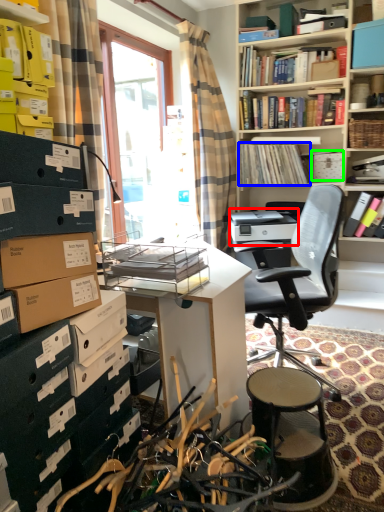
Question: Based on their relative distances, which object is nearer to printer (highlighted by a red box)? Choose from book (highlighted by a blue box) and storage box (highlighted by a green box).

Choices:
 (A) book
 (B) storage box

Answer: (A)